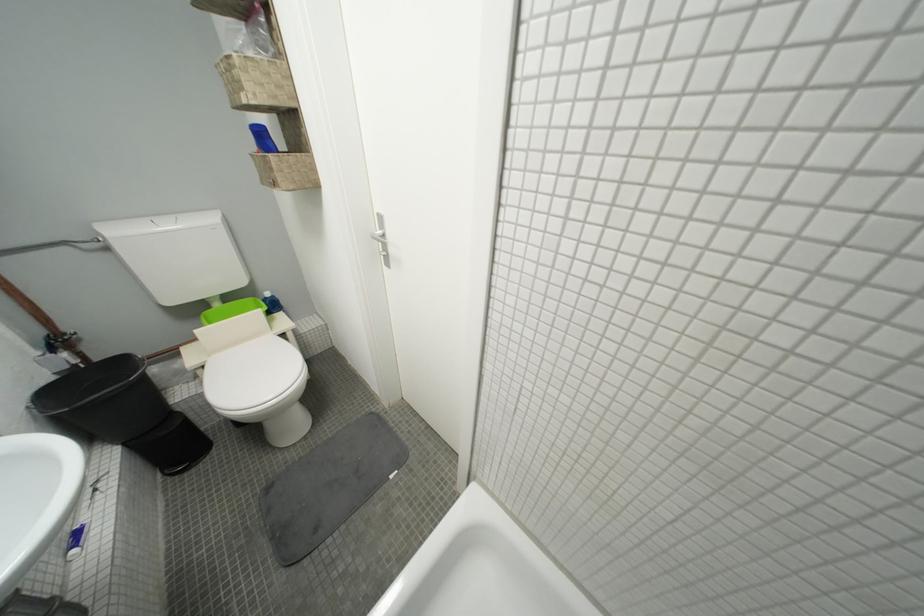
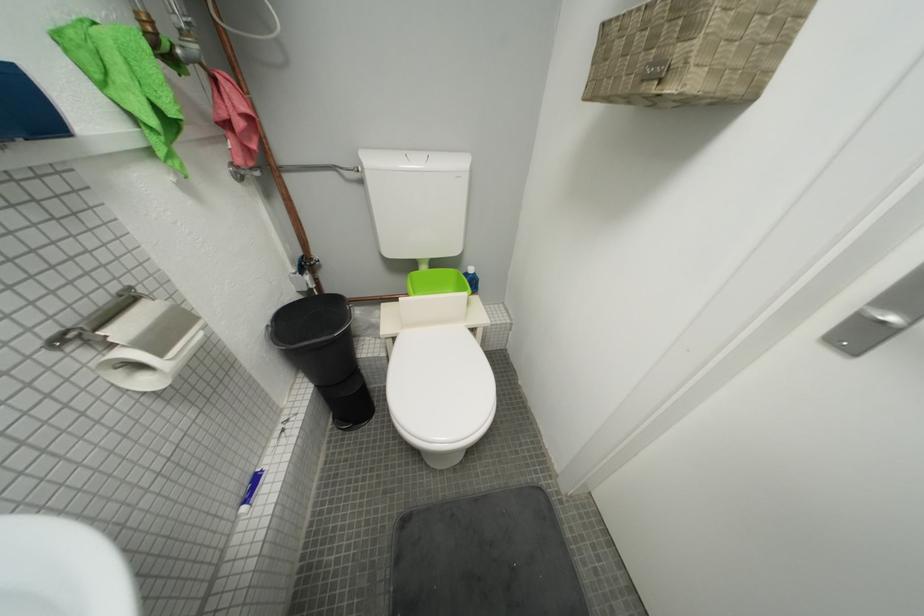
Question: The images are taken continuously from a first-person perspective. In which direction is your viewpoint rotating?

Choices:
 (A) Left
 (B) Right
 (C) Up
 (D) Down

Answer: (A)